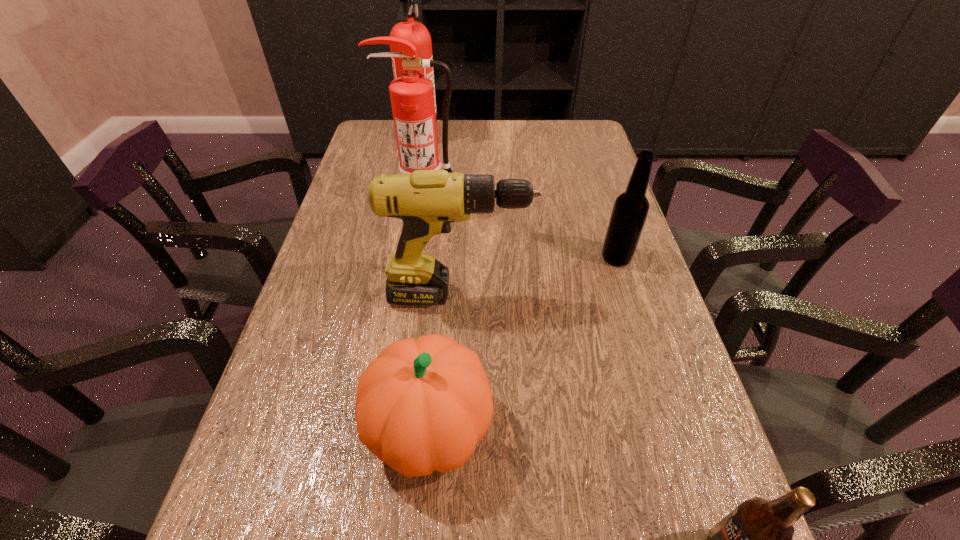
I want to click on vacant space located on the back of the pumpkin, so click(x=437, y=342).

Where is `object at the far edge`? The height and width of the screenshot is (540, 960). object at the far edge is located at coordinates [x=409, y=29].

At what (x,y) coordinates should I click in order to perform the action: click on object that is at the right edge. Please return your answer as a coordinate pair (x, y). The height and width of the screenshot is (540, 960). Looking at the image, I should click on (630, 210).

The height and width of the screenshot is (540, 960). I want to click on object located in the far left corner section of the desktop, so click(409, 29).

Identify the location of free spot at the far edge of the desktop. (460, 149).

In order to click on free space at the left edge of the desktop in this screenshot , I will do `click(329, 369)`.

Find the location of a particular element. The width and height of the screenshot is (960, 540). blank area at the right edge is located at coordinates tap(606, 188).

In the image, there is a desktop. At what (x,y) coordinates should I click in order to perform the action: click on vacant space at the far right corner. Please return your answer as a coordinate pair (x, y). Looking at the image, I should click on (568, 154).

This screenshot has width=960, height=540. Find the location of `free space between the nearer fire extinguisher and the pumpkin`. free space between the nearer fire extinguisher and the pumpkin is located at coordinates (428, 316).

The width and height of the screenshot is (960, 540). In order to click on object that is the second nearest to the nearer beer bottle in this screenshot , I will do `click(427, 201)`.